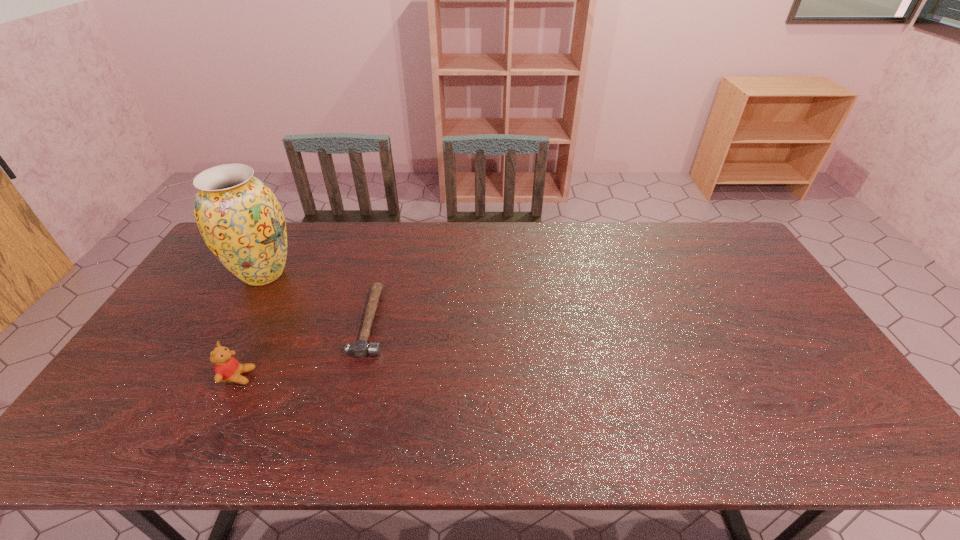
You are a GUI agent. You are given a task and a screenshot of the screen. Output one action in this format:
    pyautogui.click(x=<x>, y=<y>)
    Task: Click on the vacant area between the vase and the nearest object
    
    Given the screenshot: What is the action you would take?
    pyautogui.click(x=251, y=325)

Identify the location of empty space that is in between the vase and the second tallest object. This screenshot has height=540, width=960. (251, 325).

You are a GUI agent. You are given a task and a screenshot of the screen. Output one action in this format:
    pyautogui.click(x=<x>, y=<y>)
    Task: Click on the vacant area between the nearest object and the tallest object
    The image size is (960, 540).
    Given the screenshot: What is the action you would take?
    pyautogui.click(x=251, y=325)

Find the location of a particular element. This screenshot has height=540, width=960. free spot between the hammer and the second tallest object is located at coordinates (304, 349).

You are a GUI agent. You are given a task and a screenshot of the screen. Output one action in this format:
    pyautogui.click(x=<x>, y=<y>)
    Task: Click on the free area in between the tallest object and the hammer
    The height and width of the screenshot is (540, 960).
    Given the screenshot: What is the action you would take?
    pyautogui.click(x=317, y=298)

The width and height of the screenshot is (960, 540). Find the location of `unoccupied area between the tallest object and the hammer`. unoccupied area between the tallest object and the hammer is located at coordinates (317, 298).

This screenshot has height=540, width=960. In order to click on object that is the second closest to the rightmost object in this screenshot , I will do `click(241, 221)`.

In order to click on object identified as the second closest to the rightmost object in this screenshot , I will do `click(241, 221)`.